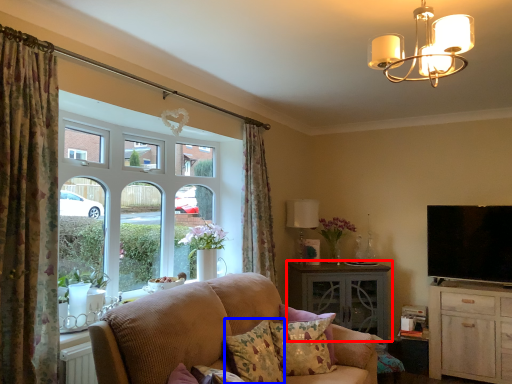
Question: Among these objects, which one is nearest to the camera, table (highlighted by a red box) or pillow (highlighted by a blue box)?

Choices:
 (A) table
 (B) pillow

Answer: (B)